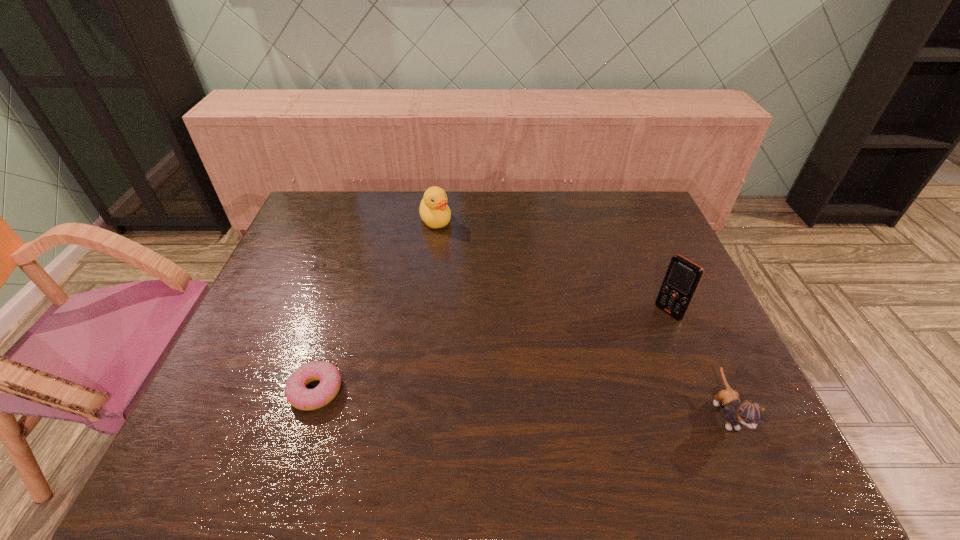
Identify the location of the shortest object. The height and width of the screenshot is (540, 960). (297, 394).

Where is `the leftmost object`? This screenshot has width=960, height=540. the leftmost object is located at coordinates (297, 394).

Where is `the third tallest object`? Image resolution: width=960 pixels, height=540 pixels. the third tallest object is located at coordinates (747, 412).

Identify the location of the farthest object. (434, 211).

What are the coordinates of `the third object from right to left` in the screenshot? It's located at (434, 211).

Locate an element on the screen. Image resolution: width=960 pixels, height=540 pixels. cellular telephone is located at coordinates (683, 276).

This screenshot has height=540, width=960. I want to click on the third nearest object, so click(683, 276).

Identify the location of vacant space situated 0.160m on the left of the shortest object. Image resolution: width=960 pixels, height=540 pixels. (220, 391).

Identify the location of free spot located at the beak of the second tallest object. (449, 254).

Where is `free spot located at the beak of the second tallest object`? free spot located at the beak of the second tallest object is located at coordinates (461, 280).